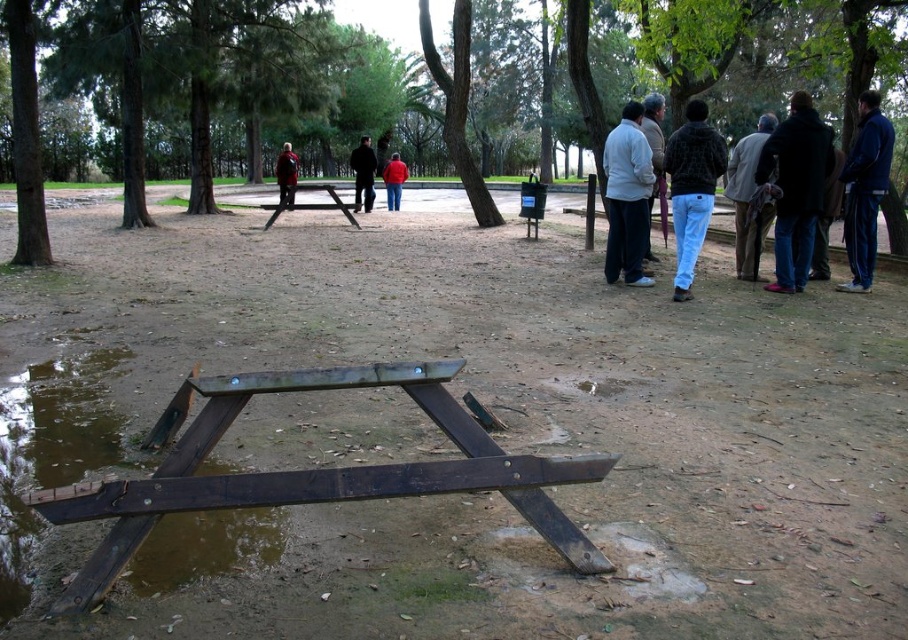
Does white matte shirt at center have a lesser height compared to black fuzzy jacket at right?

Yes.

Can you confirm if white matte shirt at center is positioned below black fuzzy jacket at right?

Actually, white matte shirt at center is above black fuzzy jacket at right.

Who is more distant from viewer, (632, 173) or (716, 150)?

The point (632, 173) is behind.

Where is `white matte shirt at center`? white matte shirt at center is located at coordinates (627, 196).

Looking at this image, which of these two, dark gray wool coat at right or dark brown leather jacket at center, stands shorter?

Standing shorter between the two is dark gray wool coat at right.

Does dark gray wool coat at right have a larger size compared to dark brown leather jacket at center?

No.

In order to click on dark gray wool coat at right in this screenshot , I will do `click(748, 198)`.

Where is `dark gray wool coat at right`? dark gray wool coat at right is located at coordinates (748, 198).

Does black fuzzy jacket at right have a greater width compared to dark brown leather jacket at center?

No, black fuzzy jacket at right is not wider than dark brown leather jacket at center.

Image resolution: width=908 pixels, height=640 pixels. What are the coordinates of `black fuzzy jacket at right` in the screenshot? It's located at (692, 188).

Does point (702, 125) come closer to viewer compared to point (354, 173)?

Yes, it is in front of point (354, 173).

Locate an element on the screen. The height and width of the screenshot is (640, 908). black fuzzy jacket at right is located at coordinates (692, 188).